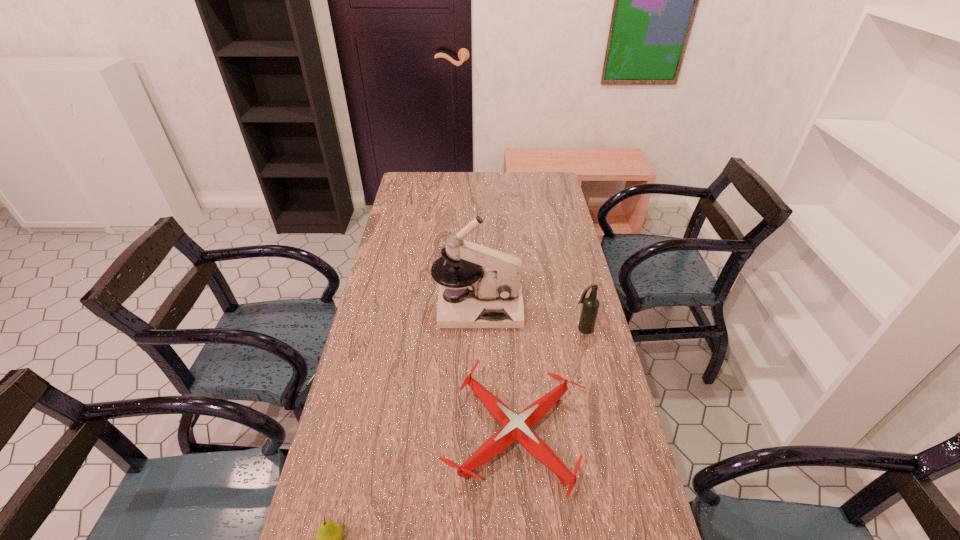
Identify the location of free spot between the shortest object and the microscope. Image resolution: width=960 pixels, height=540 pixels. (496, 372).

Select which object appears as the third closest to the beer bottle. Please provide its 2D coordinates. Your answer should be formatted as a tuple, i.e. [(x, y)], where the tuple contains the x and y coordinates of a point satisfying the conditions above.

[(329, 538)]

Point out which object is positioned as the third nearest to the second nearest object. Please provide its 2D coordinates. Your answer should be formatted as a tuple, i.e. [(x, y)], where the tuple contains the x and y coordinates of a point satisfying the conditions above.

[(329, 538)]

You are a GUI agent. You are given a task and a screenshot of the screen. Output one action in this format:
    pyautogui.click(x=<x>, y=<y>)
    Task: Click on the free space in the image that satisfies the following two spatial constraints: 1. at the eyepiece of the microscope; 2. on the right side of the rightmost object
    
    Given the screenshot: What is the action you would take?
    pyautogui.click(x=478, y=329)

Where is `free location that satisfies the following two spatial constraints: 1. at the eyepiece of the tallest object; 2. on the left side of the third shortest object`? This screenshot has width=960, height=540. free location that satisfies the following two spatial constraints: 1. at the eyepiece of the tallest object; 2. on the left side of the third shortest object is located at coordinates (478, 329).

Locate an element on the screen. This screenshot has width=960, height=540. free space that satisfies the following two spatial constraints: 1. at the eyepiece of the shortest object; 2. on the right side of the tallest object is located at coordinates (477, 436).

The height and width of the screenshot is (540, 960). In order to click on free location that satisfies the following two spatial constraints: 1. at the eyepiece of the tallest object; 2. on the left side of the shortest object in this screenshot , I will do `click(477, 436)`.

Where is `vacant space that satisfies the following two spatial constraints: 1. at the eyepiece of the microscope; 2. on the right side of the third shortest object`? This screenshot has width=960, height=540. vacant space that satisfies the following two spatial constraints: 1. at the eyepiece of the microscope; 2. on the right side of the third shortest object is located at coordinates pos(478,329).